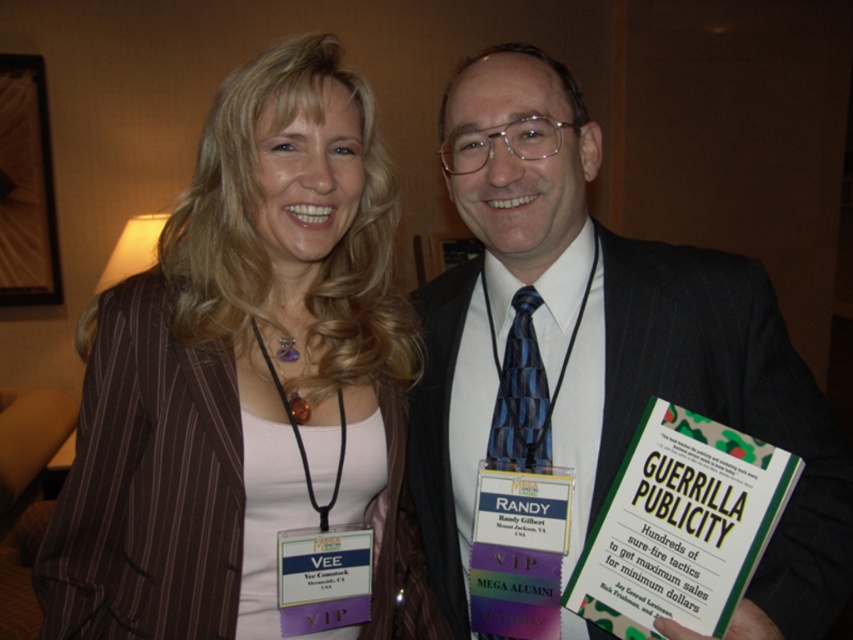
Can you confirm if brown pinstriped blazer at upper left is thinner than dark suit at center?

Correct, brown pinstriped blazer at upper left's width is less than dark suit at center's.

Does brown pinstriped blazer at upper left have a lesser height compared to dark suit at center?

Yes, brown pinstriped blazer at upper left is shorter than dark suit at center.

Is point (194, 627) positioned before point (561, 262)?

Yes, it is in front of point (561, 262).

Where is `brown pinstriped blazer at upper left`? The image size is (853, 640). brown pinstriped blazer at upper left is located at coordinates (247, 380).